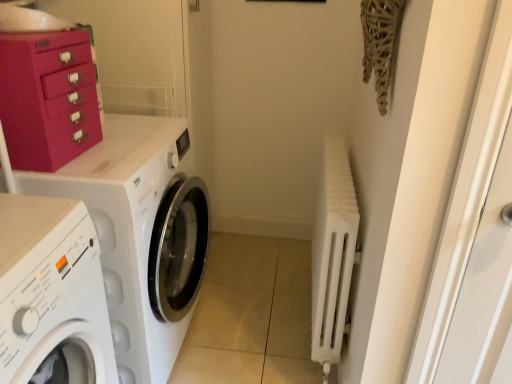
Question: Which is correct: matte pink cabinet at upper left is inside white matte radiator at right, or outside of it?

Choices:
 (A) inside
 (B) outside

Answer: (B)

Question: Is matte pink cabinet at upper left in front of or behind white matte radiator at right in the image?

Choices:
 (A) behind
 (B) front

Answer: (B)

Question: Which is nearer to the white matte washing machine at left, which is the 1th washing machine in front-to-back order?

Choices:
 (A) white matte radiator at right
 (B) white glossy washing machine at left, acting as the 2th washing machine starting from the front
 (C) matte pink cabinet at upper left

Answer: (B)

Question: Based on their relative distances, which object is nearer to the matte pink cabinet at upper left?

Choices:
 (A) white matte washing machine at left, which is the 1th washing machine in front-to-back order
 (B) white matte radiator at right
 (C) white glossy washing machine at left, acting as the 2th washing machine starting from the front

Answer: (C)